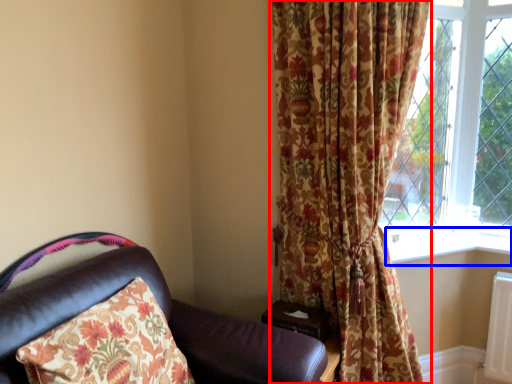
Question: Which point is closer to the camera, curtain (highlighted by a red box) or window sill (highlighted by a blue box)?

Choices:
 (A) curtain
 (B) window sill

Answer: (A)